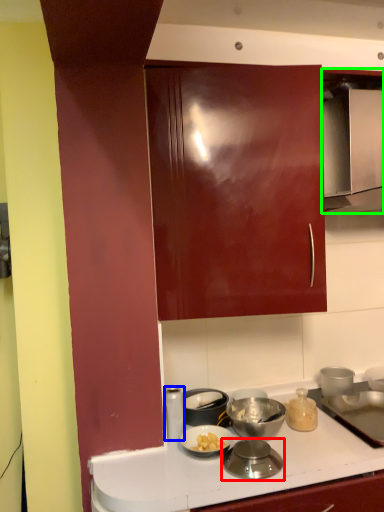
Question: Based on their relative distances, which object is nearer to kitchen appliance (highlighted by a red box)? Choose from kitchen appliance (highlighted by a blue box) and home appliance (highlighted by a green box).

Choices:
 (A) kitchen appliance
 (B) home appliance

Answer: (A)